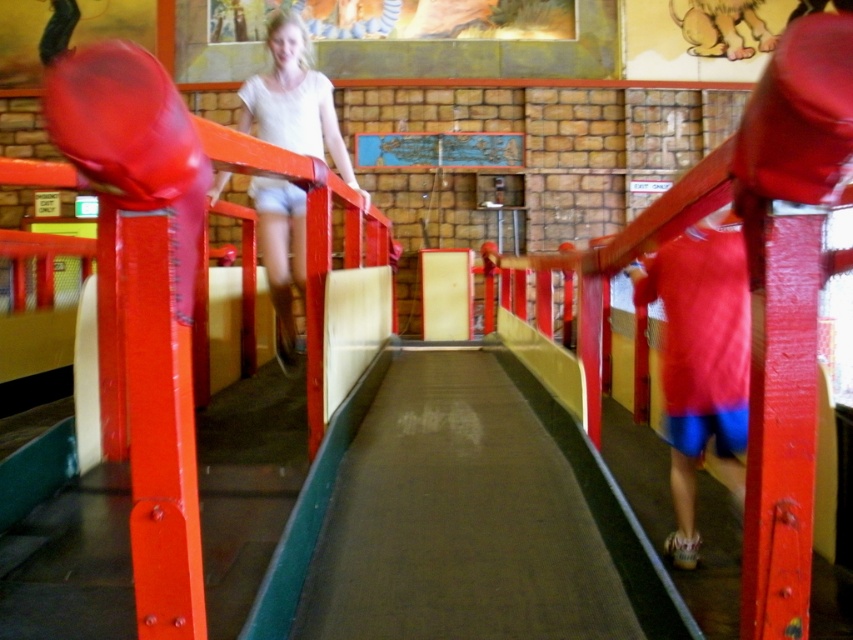
You are a parent trying to find your child in the playground. You remember your child is wearing shorts. There are two children in the image with shorts. One is wearing red fabric shorts at center and the other is wearing white matte shorts at upper center. Which pair of shorts belongs to your child if your child has the smaller pair?

The red fabric shorts at center is smaller than the white matte shorts at upper center, so the red fabric shorts at center belongs to your child.

You are a parent supervising children in the playground. You see two children wearing shorts. The first child has red fabric shorts at center and the second has white matte shorts at upper center. Which child is closer to you?

The red fabric shorts at center is closer to the viewer than white matte shorts at upper center, so the child with red fabric shorts at center is closer to you.

You are a parent trying to locate your child in the playground. You see two children wearing shorts. The first child has red fabric shorts at center and the second has white matte shorts at upper center. Which child is positioned to the right side of the other?

The red fabric shorts at center is to the right of white matte shorts at upper center, so the child with red fabric shorts at center is positioned to the right of the child with white matte shorts at upper center.